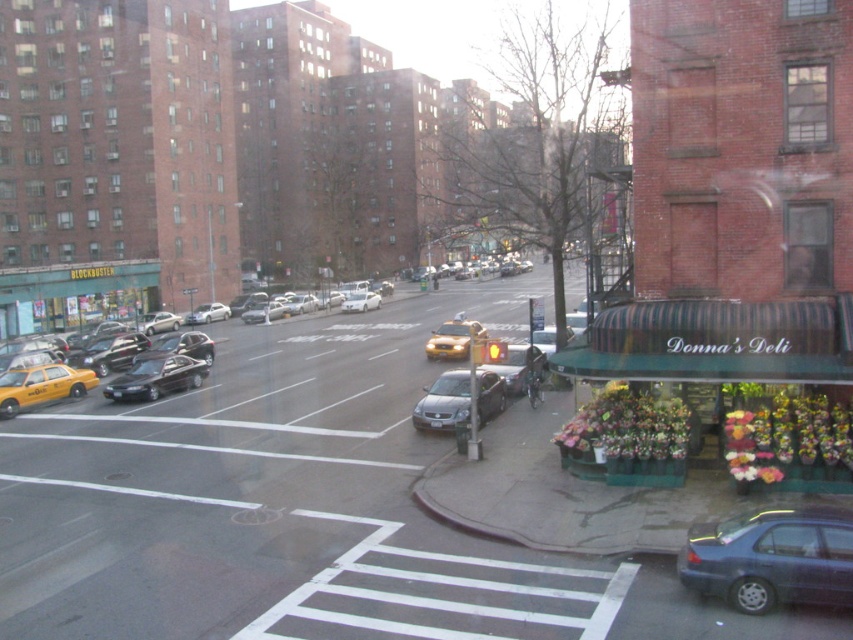
Question: Considering the relative positions of slate gray sedan at lower right and shiny black sedan at center in the image provided, where is slate gray sedan at lower right located with respect to shiny black sedan at center?

Choices:
 (A) left
 (B) right

Answer: (B)

Question: Estimate the real-world distances between objects in this image. Which object is closer to the yellow matte taxi at center?

Choices:
 (A) silver metallic sedan at center
 (B) shiny black sedan at center-left
 (C) white matte sedan at center
 (D) satin silver sedan at center

Answer: (B)

Question: Can you confirm if satin silver sedan at center is bigger than silver metallic sedan at center?

Choices:
 (A) no
 (B) yes

Answer: (A)

Question: Which object is positioned farthest from the white matte sedan at center?

Choices:
 (A) slate gray sedan at lower right
 (B) shiny black sedan at center-left
 (C) shiny black sedan at center

Answer: (A)

Question: Estimate the real-world distances between objects in this image. Which object is closer to the yellow matte taxi at center?

Choices:
 (A) yellow rubber taxi at left
 (B) shiny black sedan at center-left

Answer: (B)

Question: In this image, where is slate gray sedan at lower right located relative to yellow rubber taxi at left?

Choices:
 (A) left
 (B) right

Answer: (B)